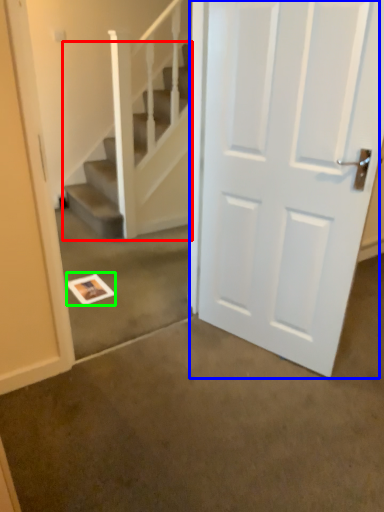
Question: Estimate the real-world distances between objects in this image. Which object is closer to stairs (highlighted by a red box), door (highlighted by a blue box) or postcard (highlighted by a green box)?

Choices:
 (A) door
 (B) postcard

Answer: (B)